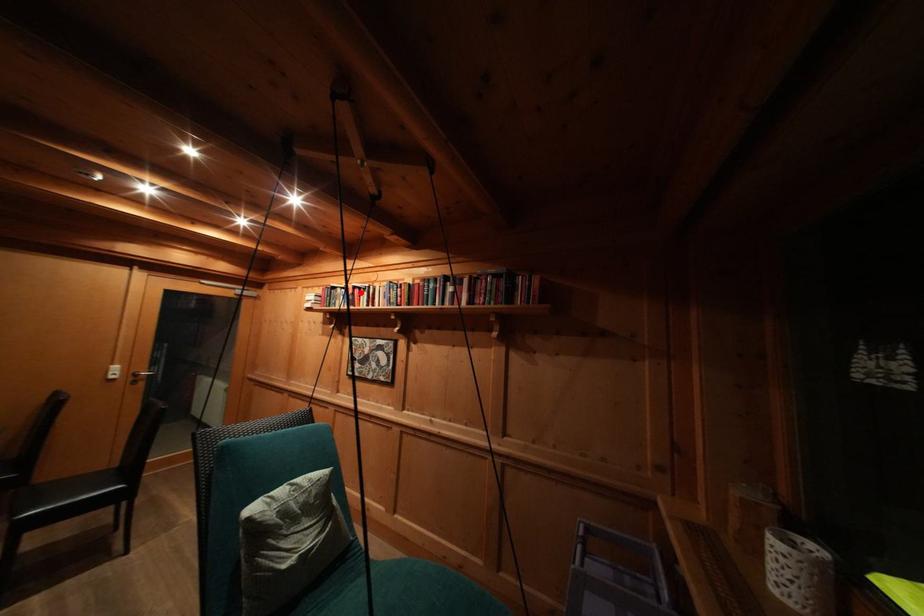
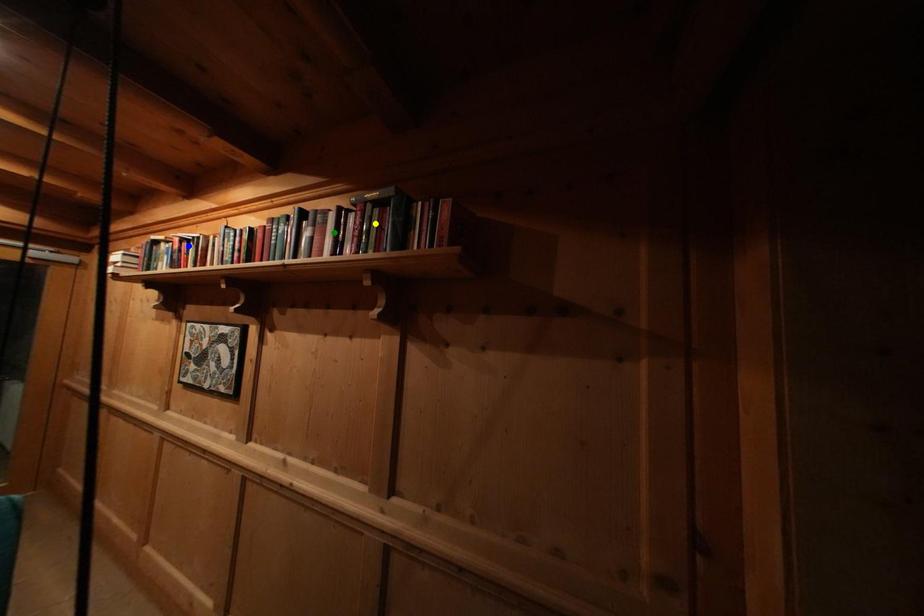
Question: I am providing you with two images of the same scene from different viewpoints. A red point is marked on the first image. You are given multiple points on the second image. Which mark in image 2 goes with the point in image 1?

Choices:
 (A) yellow point
 (B) green point
 (C) blue point

Answer: (C)